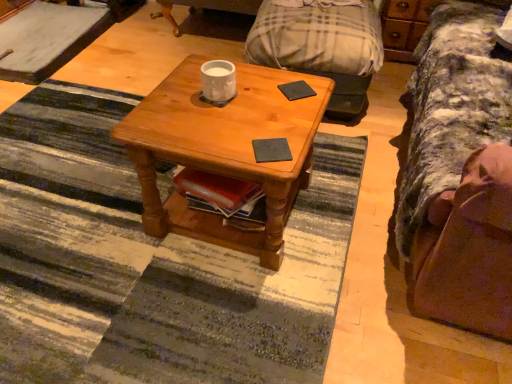
Where is `vacant area that is in front of black matte pad at center, the first pad when ordered from top to bottom`? vacant area that is in front of black matte pad at center, the first pad when ordered from top to bottom is located at coordinates (289, 114).